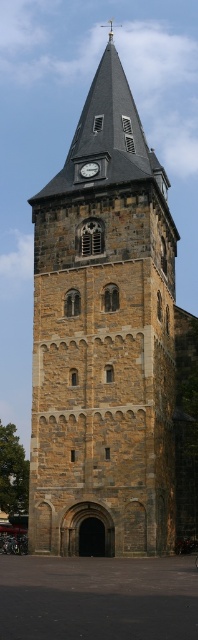
Looking at this image, you are standing in front of the historic stone tower and want to place a decorative flagpole on the building. The flagpole needs to be placed below the white clock face at upper center. Is there enough space on the brown stone church at center for the flagpole?

The brown stone church at center is above the white clock face at upper center, so placing the flagpole below the white clock face at upper center would require it to be placed on the brown stone church at center, which should have sufficient space as the church structure is large enough to accommodate it.

You are standing in front of the historic stone tower and want to determine the relative positions of two points marked on the tower. Which point is closer to you, point (94,211) or point (96,172)?

Point (94,211) is closer to the viewer than point (96,172).